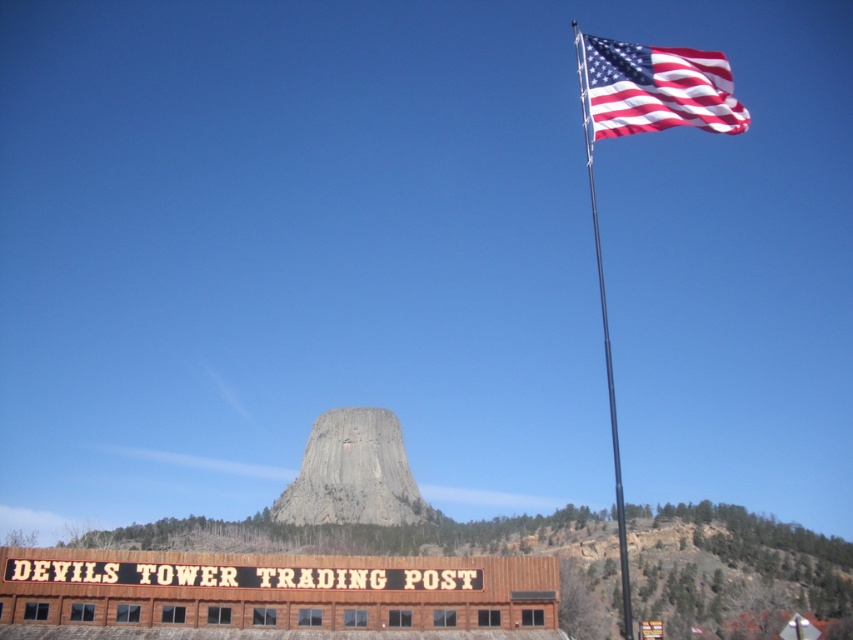
Question: Which of the following is the closest to the observer?

Choices:
 (A) (374, 522)
 (B) (622, 564)
 (C) (639, 104)

Answer: (C)

Question: Can you confirm if gray rock formation at center is positioned to the right of metallic flag pole at upper right?

Choices:
 (A) no
 (B) yes

Answer: (A)

Question: Is gray rock formation at center smaller than metallic flag pole at upper right?

Choices:
 (A) yes
 (B) no

Answer: (A)

Question: Based on their relative distances, which object is nearer to the gray rock formation at center?

Choices:
 (A) metallic flag pole at upper right
 (B) american flag at upper right

Answer: (A)

Question: Among these objects, which one is farthest from the camera?

Choices:
 (A) gray rock formation at center
 (B) american flag at upper right

Answer: (A)

Question: From the image, what is the correct spatial relationship of american flag at upper right in relation to metallic flag pole at upper right?

Choices:
 (A) above
 (B) below

Answer: (A)